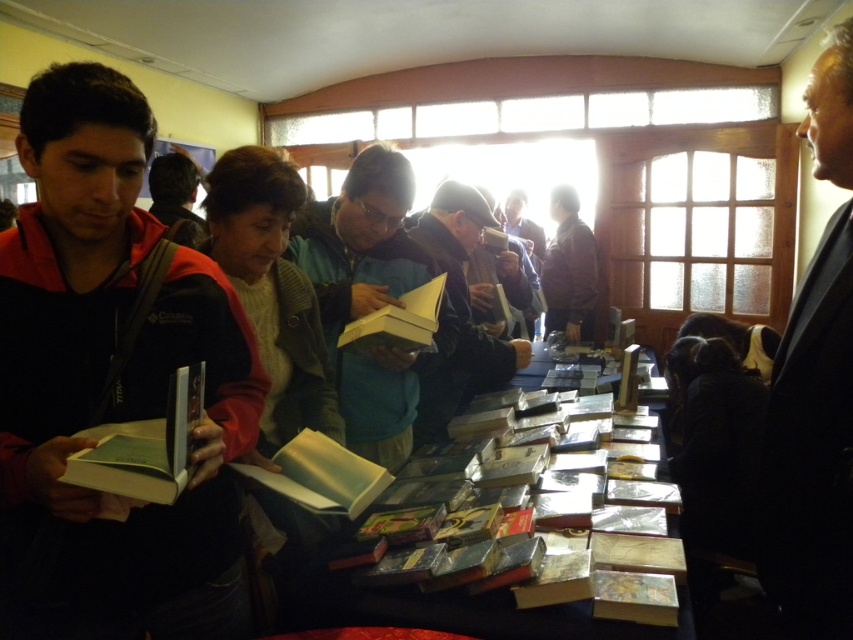
You are standing at the entrance of the bookstore and want to reach the white paper book at center. Which direction should you move in to get there?

Since the white paper book at center is located at point 0.744 on the x axis and 0.377 on the y axis, you should move forward and to the right to reach it.

You are a customer in the bookstore and want to pick up the dark gray fabric jacket at center. Which direction should you move from the dark blue jacket at left to reach it?

The dark blue jacket at left is to the left of dark gray fabric jacket at center, so you should move to the right to reach the dark gray fabric jacket at center.

You are standing at the entrance of the bookstore and see two points marked on the floor. The first point is at point (364, 621) and the second is at point (192, 426). If you want to reach the point that is closer to the entrance, which point should you go to?

Point (192, 426) is closer to the entrance because it is in front of point (364, 621), which is behind it.